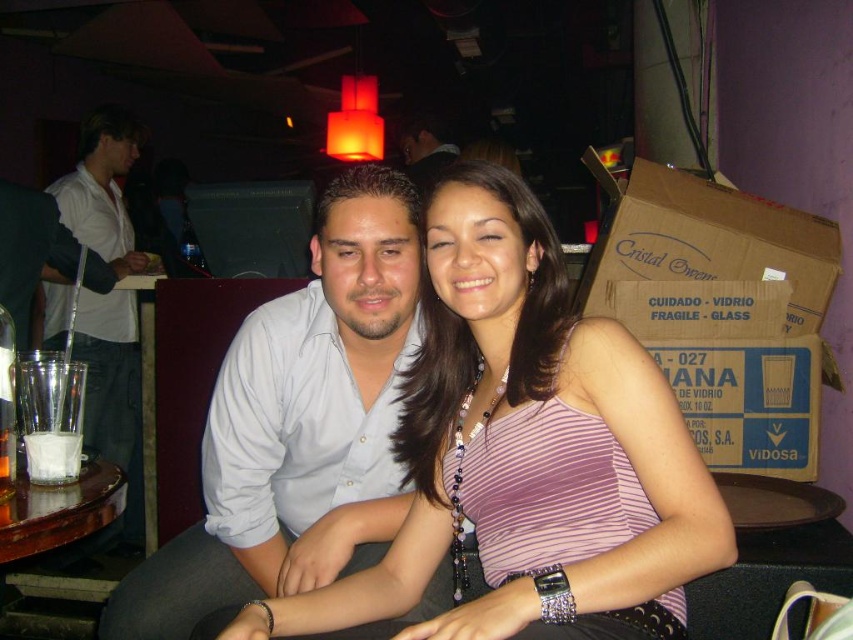
You are a photographer at the event and want to take a photo of both the white shirt at center and the white shirt at left. However, you need to ensure that both shirts are fully visible in the photo. Based on their positions, which shirt should you focus on first to avoid blocking the other?

The white shirt at center is in front of the white shirt at left. To ensure both are fully visible, focus on the white shirt at left first before adjusting to include the white shirt at center in the frame.

You are a photographer trying to capture the purple striped tank top at center in the image. You notice a point at coordinates (525,445). Is this point located on the purple striped tank top at center?

Yes, the point at (525,445) is located on the purple striped tank top at center as stated in the description.

You are a photographer trying to capture a candid shot of the two people in the center of the image. The purple striped tank top at center and the white shirt at center are two clothing items you noticed. If your camera has a depth of field that can focus on objects within 10 inches of each other, will both items be in focus?

The purple striped tank top at center and white shirt at center are 9.51 inches apart, so yes, both items will be in focus since the distance between them is within the 10 inches depth of field.